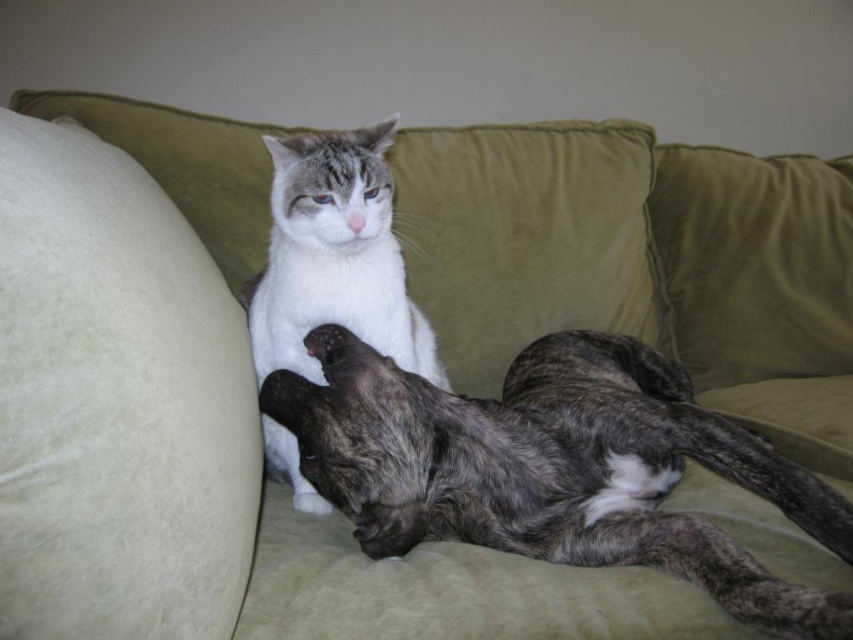
Who is lower down, speckled fur dog at center or white soft fur cat at center?

speckled fur dog at center is lower down.

Is speckled fur dog at center to the left of white soft fur cat at center from the viewer's perspective?

No, speckled fur dog at center is not to the left of white soft fur cat at center.

Where is `speckled fur dog at center`? speckled fur dog at center is located at coordinates 556,468.

Is white soft cushion at left behind speckled fur dog at center?

No, it is in front of speckled fur dog at center.

The image size is (853, 640). I want to click on white soft cushion at left, so click(115, 403).

Is point (65, 458) closer to viewer compared to point (463, 536)?

That is True.

This screenshot has width=853, height=640. I want to click on white soft cushion at left, so click(115, 403).

How much distance is there between speckled fur dog at center and dark gray fur paw at center?

speckled fur dog at center is 29.37 centimeters from dark gray fur paw at center.

Does speckled fur dog at center have a lesser height compared to dark gray fur paw at center?

No, speckled fur dog at center is not shorter than dark gray fur paw at center.

Identify the location of speckled fur dog at center. pos(556,468).

Where is `speckled fur dog at center`? The height and width of the screenshot is (640, 853). speckled fur dog at center is located at coordinates (556, 468).